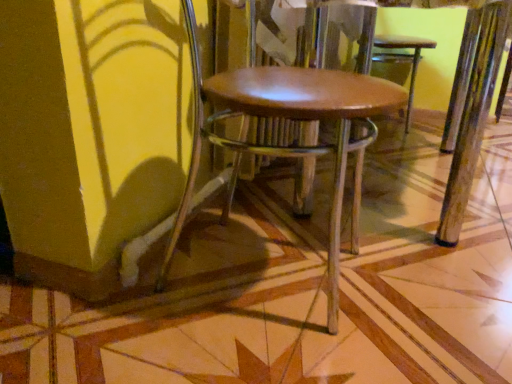
Describe the element at coordinates (291, 120) in the screenshot. I see `brown leather chair at center` at that location.

Locate an element on the screen. brown leather chair at center is located at coordinates (291, 120).

Where is `brown leather chair at center`? brown leather chair at center is located at coordinates (291, 120).